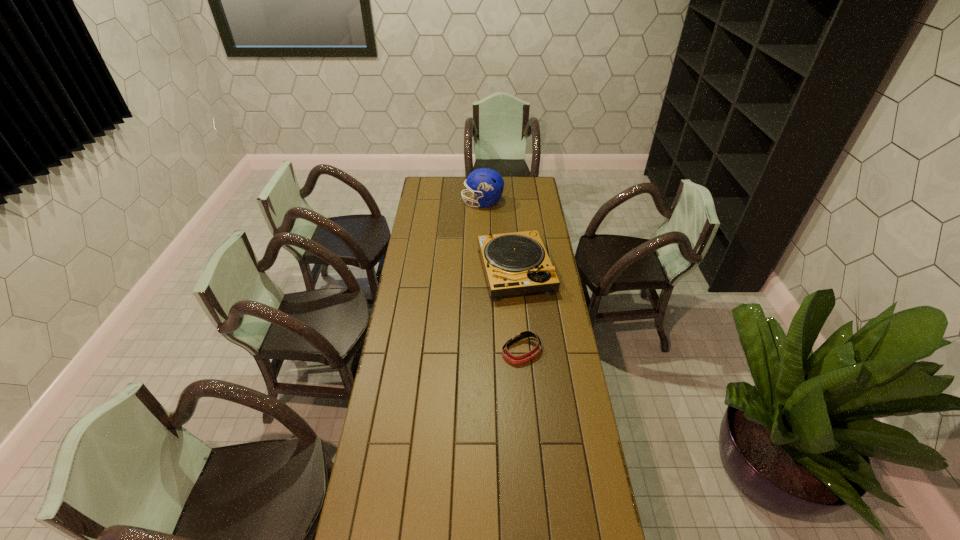
Find the location of `vacant point that satisfies the following two spatial constraints: 1. on the back side of the second tallest object; 2. on the front-facing side of the farthest object`. vacant point that satisfies the following two spatial constraints: 1. on the back side of the second tallest object; 2. on the front-facing side of the farthest object is located at coordinates (509, 202).

Locate an element on the screen. vacant space that satisfies the following two spatial constraints: 1. on the front-facing side of the football helmet; 2. on the right side of the nearest object is located at coordinates (484, 351).

Where is `free space that satisfies the following two spatial constraints: 1. on the front-facing side of the tallest object; 2. on the right side of the second farthest object`? The width and height of the screenshot is (960, 540). free space that satisfies the following two spatial constraints: 1. on the front-facing side of the tallest object; 2. on the right side of the second farthest object is located at coordinates (483, 271).

Where is `vacant space that satisfies the following two spatial constraints: 1. on the front-facing side of the second shortest object; 2. on the right side of the tallest object`? The height and width of the screenshot is (540, 960). vacant space that satisfies the following two spatial constraints: 1. on the front-facing side of the second shortest object; 2. on the right side of the tallest object is located at coordinates (483, 271).